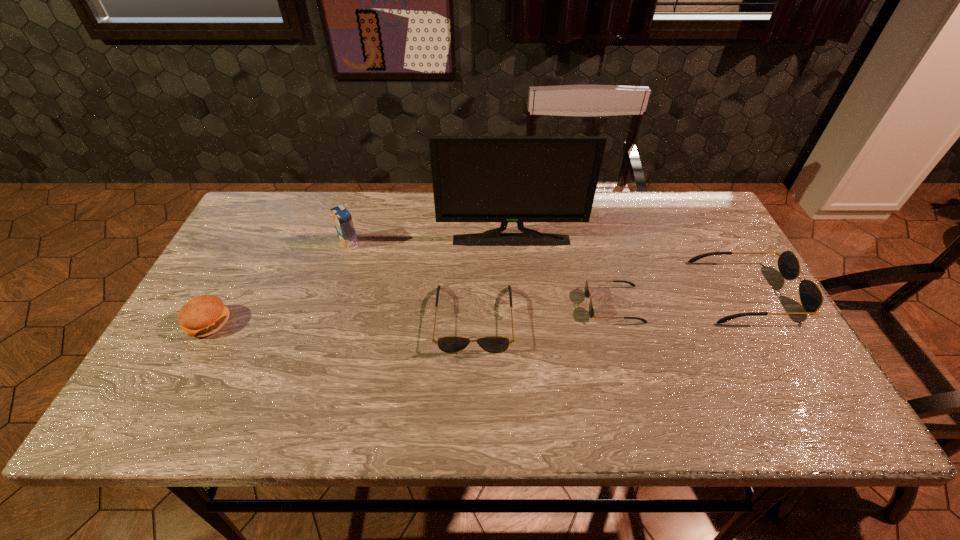
Where is `vacant region located 0.360m on the front-facing side of the shortest sunglasses`? vacant region located 0.360m on the front-facing side of the shortest sunglasses is located at coordinates (446, 305).

In order to click on vacant area located 0.220m on the back of the second tallest object in this screenshot , I will do `click(365, 192)`.

Locate an element on the screen. vacant space located on the back of the hamburger is located at coordinates (229, 284).

Identify the location of vacant region located 0.120m on the front-facing side of the tallest object. (514, 275).

What are the coordinates of `orange_juice at the far edge` in the screenshot? It's located at (342, 218).

Where is `monitor situated at the far edge`? This screenshot has width=960, height=540. monitor situated at the far edge is located at coordinates (504, 179).

What are the coordinates of `object present at the left edge` in the screenshot? It's located at (204, 315).

The height and width of the screenshot is (540, 960). What are the coordinates of `object at the right edge` in the screenshot? It's located at (811, 297).

This screenshot has width=960, height=540. In order to click on free space at the far edge of the desktop in this screenshot , I will do `click(607, 224)`.

Identify the location of blank space at the near edge. (626, 370).